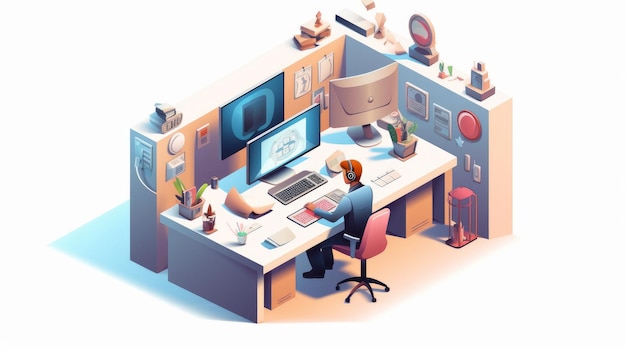
Find the location of a particular element. This screenshot has width=626, height=351. computer screen is located at coordinates (377, 245).